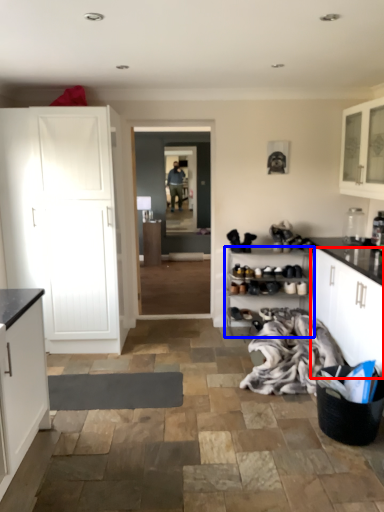
Question: Which of the following is the farthest to the observer, cabinetry (highlighted by a red box) or shelf (highlighted by a blue box)?

Choices:
 (A) cabinetry
 (B) shelf

Answer: (B)